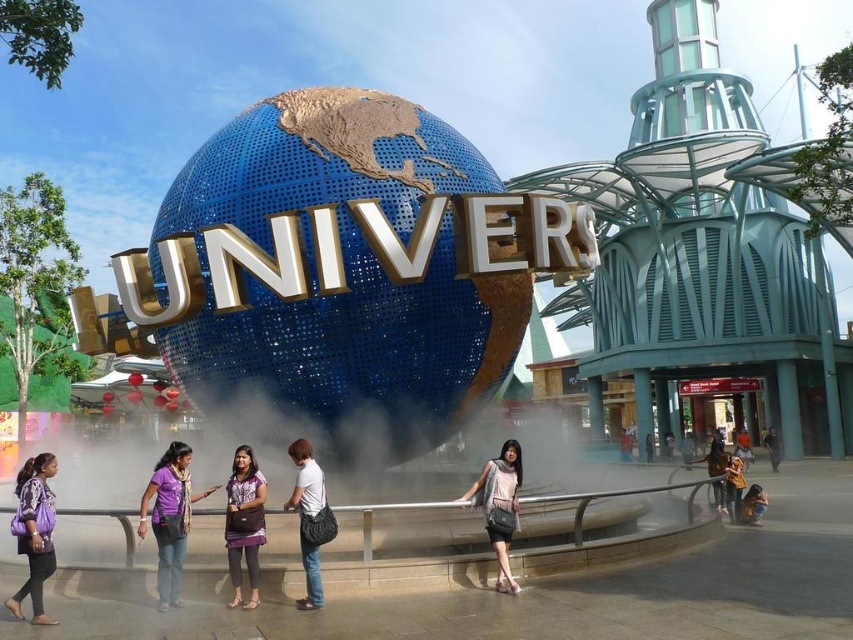
Question: Is matte gray dress at center wider than matte black jacket at lower right?

Choices:
 (A) no
 (B) yes

Answer: (A)

Question: Which object is closer to the camera taking this photo?

Choices:
 (A) matte black jacket at lower right
 (B) purple fabric scarf at lower center

Answer: (B)

Question: Can you confirm if purple fabric scarf at lower center is positioned to the left of white matte bag at center?

Choices:
 (A) no
 (B) yes

Answer: (B)

Question: Among these points, which one is farthest from the camera?

Choices:
 (A) (164, 524)
 (B) (485, 474)

Answer: (B)

Question: Which object appears farthest from the camera in this image?

Choices:
 (A) purple fabric dress at center
 (B) matte black jacket at lower right
 (C) matte gray dress at center
 (D) white matte bag at center

Answer: (B)

Question: Does purple fabric scarf at lower center have a greater width compared to white matte bag at center?

Choices:
 (A) yes
 (B) no

Answer: (A)